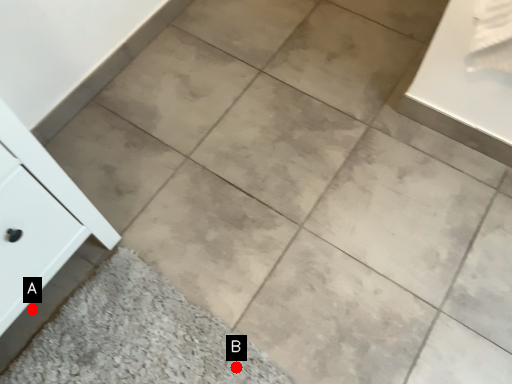
Question: Two points are circled on the image, labeled by A and B beside each circle. Which point is closer to the camera taking this photo?

Choices:
 (A) A is closer
 (B) B is closer

Answer: (B)